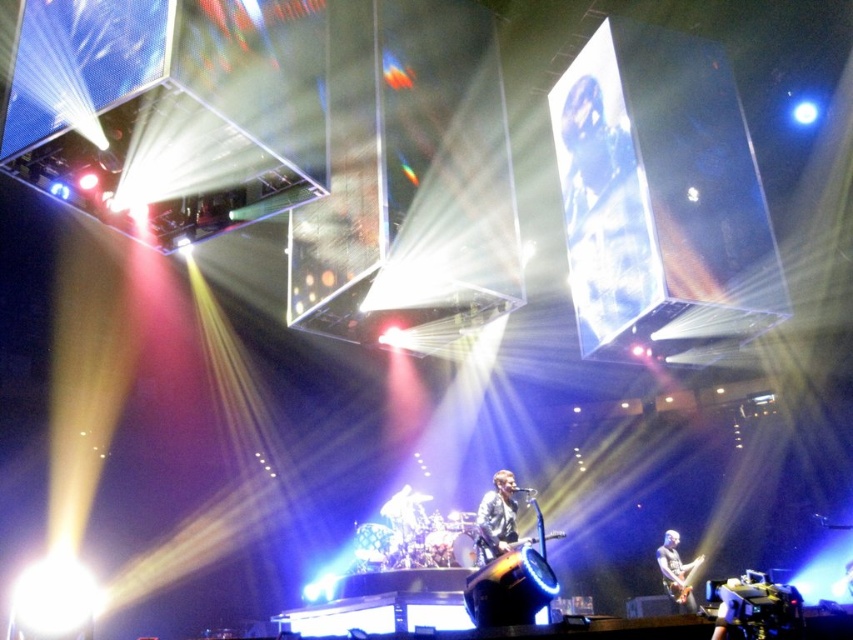
You are a photographer at the concert. You want to take a picture of both the shiny black jacket at center and the shiny black guitar at lower right. Since you have a limited focus range, which object should you focus on first to ensure it stays in focus if you need to prioritize based on their sizes?

The shiny black jacket at center is thinner than the shiny black guitar at lower right, so you should focus on the shiny black jacket at center first since it is smaller and requires precise focus.

You are a photographer at the concert. You want to capture a photo where both the shiny black jacket at center and the metallic silver guitar at lower right are visible. Given their sizes, which object should you focus on to ensure both fit in the frame?

The shiny black jacket at center has a lesser width compared to the metallic silver guitar at lower right, so you should focus on the metallic silver guitar at lower right as it is wider and ensuring it fits will help include the smaller jacket in the frame.

You are standing at the camera position and want to throw a water bottle to the point marked at coordinates point (662, 556). Can you estimate how far you need to throw the water bottle to reach that point?

The point marked at coordinates point (662, 556) is 29.59 feet away from the camera, so you need to throw the water bottle approximately 29.59 feet to reach that point.